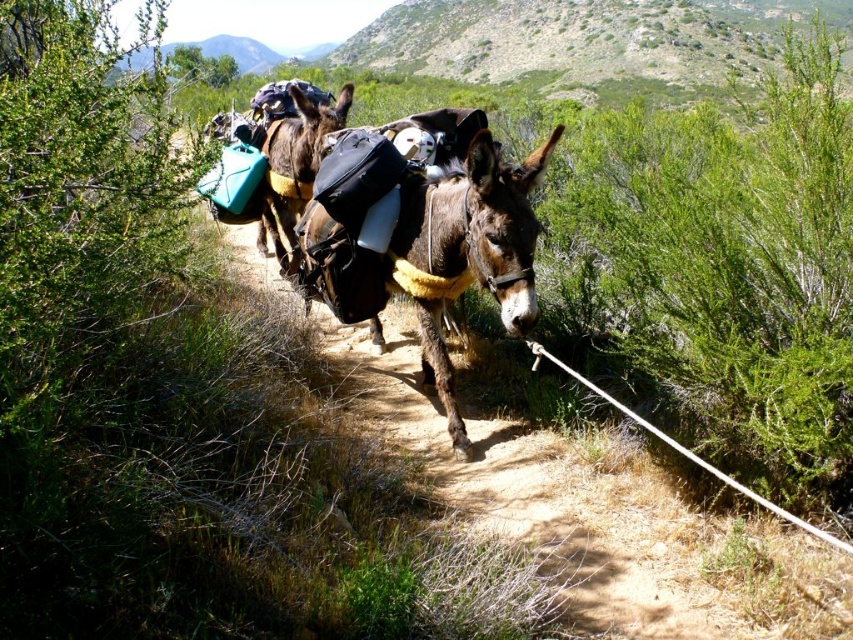
Can you confirm if brown fuzzy pack at center is positioned above brown leather saddlebags at center?

Incorrect, brown fuzzy pack at center is not positioned above brown leather saddlebags at center.

Is brown fuzzy pack at center to the left of brown leather saddlebags at center from the viewer's perspective?

In fact, brown fuzzy pack at center is to the right of brown leather saddlebags at center.

Between point (352, 310) and point (299, 97), which one is positioned behind?

The point (299, 97) is behind.

Locate an element on the screen. brown fuzzy pack at center is located at coordinates (439, 257).